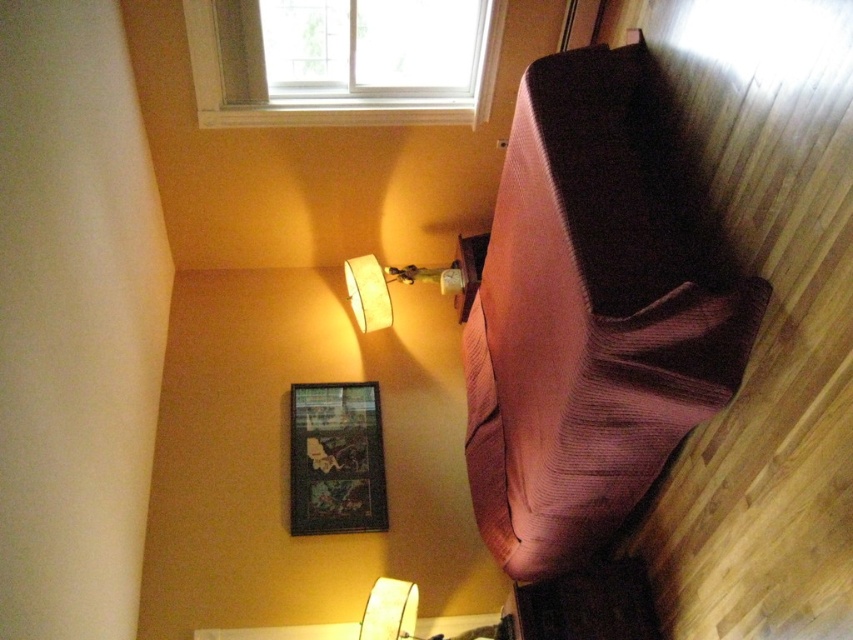
You are standing in the room and want to hang a picture frame that is 1 meter tall. The frame needs to be placed above the white plastic window at upper center and the white fabric lampshade at upper center. Considering their heights, which object should the frame be placed above to ensure it fits properly?

The white plastic window at upper center is much taller than the white fabric lampshade at upper center. Therefore, placing the frame above the white fabric lampshade at upper center would be more appropriate since the frame is 1 meter tall and the lampshade is shorter, leaving enough space for the frame to fit properly.

Consider the image. You are trying to decide whether to place a new decorative pillow on the pink corduroy sleeping bag at right or the white fabric lampshade at upper center. Based on their heights, which one can accommodate a taller pillow?

The pink corduroy sleeping bag at right has a greater height compared to the white fabric lampshade at upper center, so it can accommodate a taller pillow.

You are standing in the room and want to determine which of the two points, point (618, 388) or point (428, 68), is nearer to you. Based on the scene description, which point is closer?

Point (618, 388) is closer to the camera than point (428, 68), so it is the nearer point.